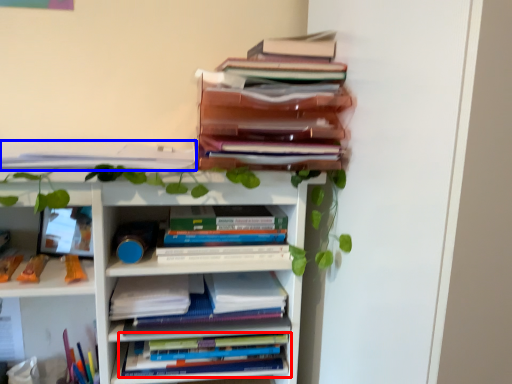
Question: Which of the following is the farthest to the observer, book (highlighted by a red box) or book (highlighted by a blue box)?

Choices:
 (A) book
 (B) book

Answer: (A)